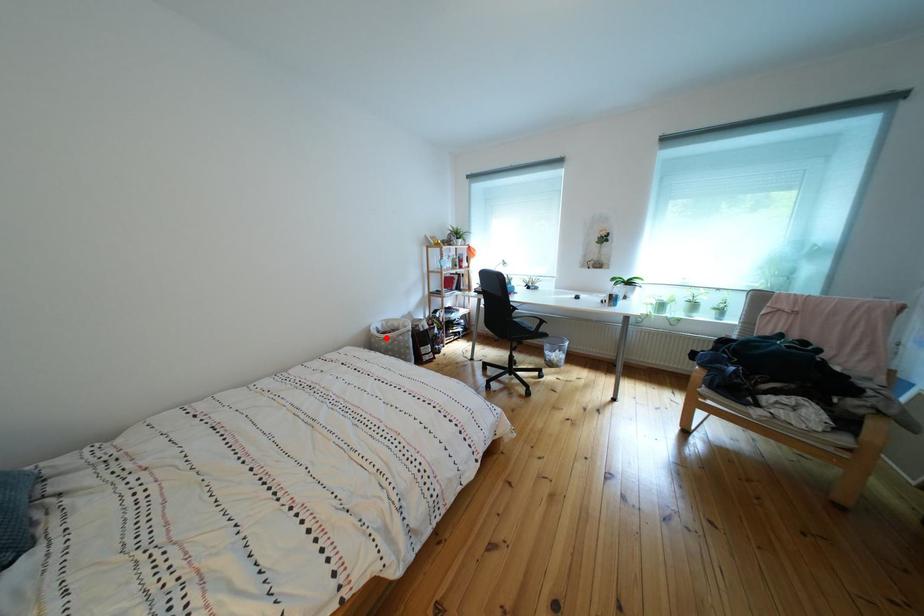
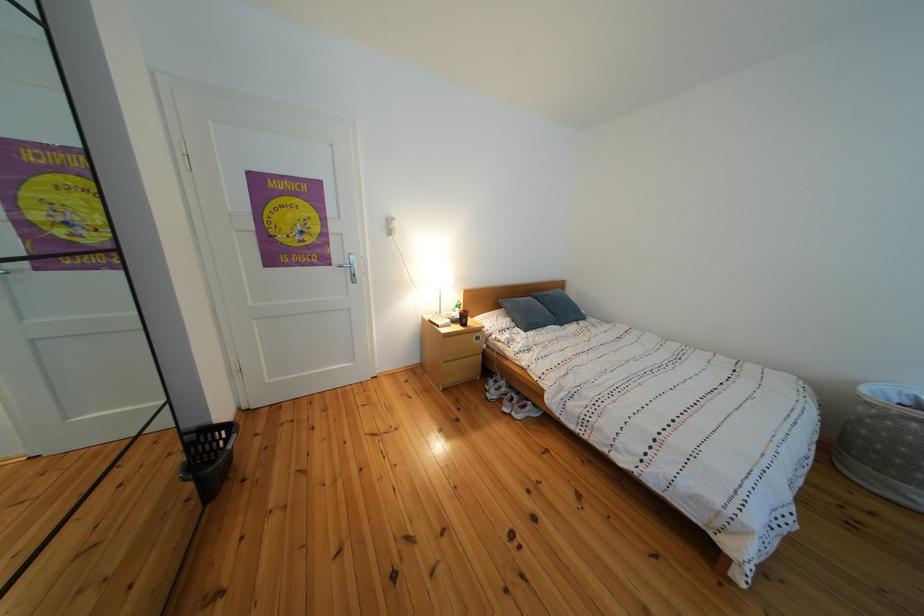
The point at the highlighted location is marked in the first image. Where is the corresponding point in the second image?

(890, 398)